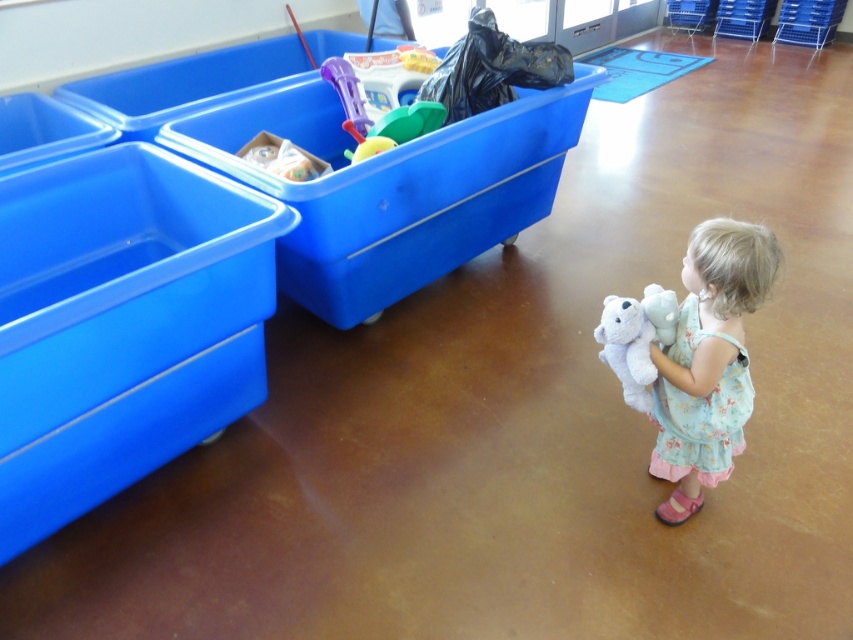
You are organizing a classroom and need to place the white plush teddy bear at lower right on top of the blue plastic bin at left. Can the teddy bear fit on top of the bin without falling off?

The blue plastic bin at left has a greater height compared to white plush teddy bear at lower right. Since the bin is taller, the teddy bear can be placed on top without falling off as it is shorter and more stable.

You are standing in the classroom and need to place a new toy into the blue plastic bin at left. Based on its 2D location coordinates, where should you move to in order to place the toy into the bin?

The blue plastic bin at left is located at the 2D coordinates point (122, 324), so you should move to that position to place the toy into the bin.

You are a parent helping your child organize their play area. You have a blue plastic bin at left and a white plush teddy bear at lower right. If you want to store the teddy bear in the bin, will it fit based on their sizes?

The blue plastic bin at left might be wider than the white plush teddy bear at lower right, so there is a possibility that the teddy bear will fit inside the bin.